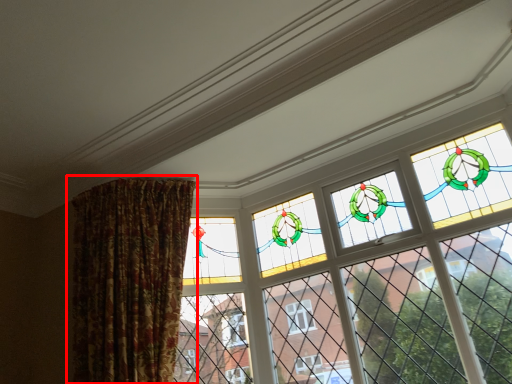
Question: From the image's perspective, where is curtain (annotated by the red box) located in relation to window in the image?

Choices:
 (A) below
 (B) above

Answer: (A)